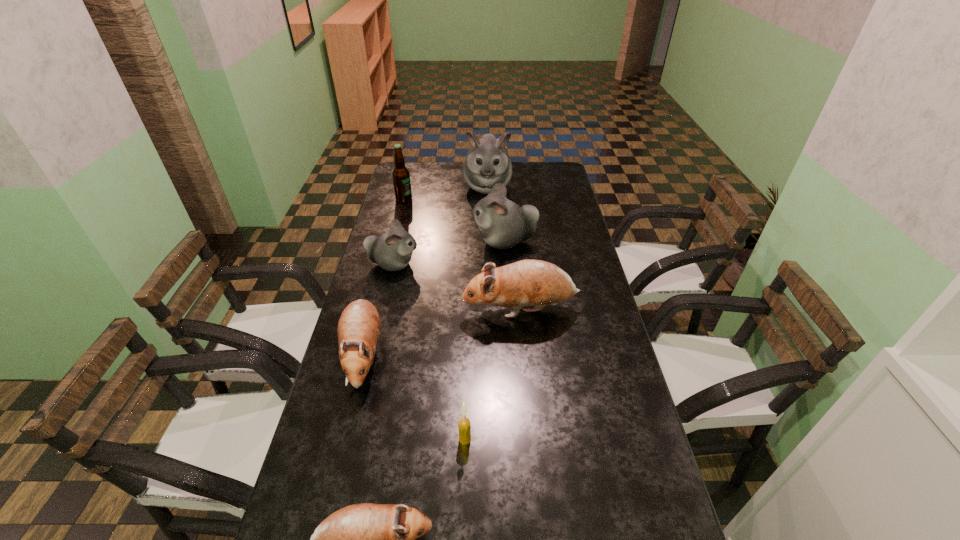
Where is `vacant area that satisfies the following two spatial constraints: 1. on the face of the leftmost white hamster; 2. at the face of the second biggest brown hamster`? vacant area that satisfies the following two spatial constraints: 1. on the face of the leftmost white hamster; 2. at the face of the second biggest brown hamster is located at coordinates (372, 355).

Where is `free location that satisfies the following two spatial constraints: 1. on the label of the brown beer bottle; 2. at the face of the second smallest brown hamster`? free location that satisfies the following two spatial constraints: 1. on the label of the brown beer bottle; 2. at the face of the second smallest brown hamster is located at coordinates (366, 355).